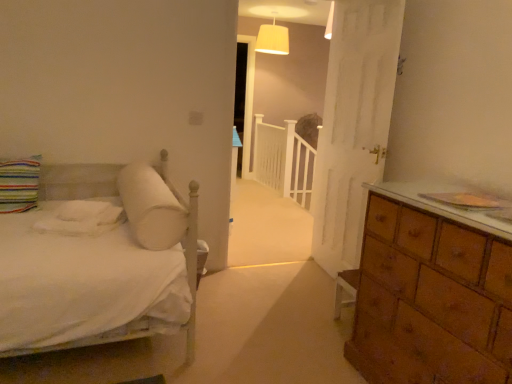
I want to click on white fabric lampshade at upper center, so click(x=273, y=39).

What do you see at coordinates (273, 39) in the screenshot? The image size is (512, 384). I see `white fabric lampshade at upper center` at bounding box center [273, 39].

Describe the element at coordinates (151, 207) in the screenshot. Image resolution: width=512 pixels, height=384 pixels. I see `white soft pillow at upper left, marked as the 1th pillow in a right-to-left arrangement` at that location.

This screenshot has height=384, width=512. I want to click on striped fabric pillow at left, marked as the 1th pillow in a left-to-right arrangement, so click(19, 184).

From the image's perspective, count 1st pillows upward from the white cotton sheet at left and point to it. Please provide its 2D coordinates.

[(151, 207)]

Is white soft pillow at upper left, positioned as the second pillow in left-to-right order, looking in the opposite direction of white cotton sheet at left?

No, white soft pillow at upper left, positioned as the second pillow in left-to-right order, is not facing away from white cotton sheet at left.

Is white soft pillow at upper left, marked as the 1th pillow in a right-to-left arrangement, smaller than white cotton sheet at left?

No.

From a real-world perspective, who is located higher, white soft pillow at upper left, positioned as the second pillow in left-to-right order, or white cotton sheet at left?

From a 3D spatial view, white soft pillow at upper left, positioned as the second pillow in left-to-right order, is above.

Looking at this image, from the image's perspective, is white soft pillow at upper left, positioned as the second pillow in left-to-right order, on striped fabric pillow at left, marked as the 1th pillow in a left-to-right arrangement?

Incorrect, from the image's perspective, white soft pillow at upper left, positioned as the second pillow in left-to-right order, is lower than striped fabric pillow at left, marked as the 1th pillow in a left-to-right arrangement.

Based on their sizes in the image, would you say white soft pillow at upper left, marked as the 1th pillow in a right-to-left arrangement, is bigger or smaller than striped fabric pillow at left, which ranks as the 2th pillow in right-to-left order?

Clearly, white soft pillow at upper left, marked as the 1th pillow in a right-to-left arrangement, is larger in size than striped fabric pillow at left, which ranks as the 2th pillow in right-to-left order.

Is white soft pillow at upper left, marked as the 1th pillow in a right-to-left arrangement, at the right side of striped fabric pillow at left, marked as the 1th pillow in a left-to-right arrangement?

Yes, white soft pillow at upper left, marked as the 1th pillow in a right-to-left arrangement, is to the right of striped fabric pillow at left, marked as the 1th pillow in a left-to-right arrangement.

Where is `pillow located underneath the striped fabric pillow at left, marked as the 1th pillow in a left-to-right arrangement (from a real-world perspective)`? The height and width of the screenshot is (384, 512). pillow located underneath the striped fabric pillow at left, marked as the 1th pillow in a left-to-right arrangement (from a real-world perspective) is located at coordinates (151, 207).

Which is in front, white fabric lampshade at upper center or white cotton sheet at left?

Positioned in front is white cotton sheet at left.

Does white fabric lampshade at upper center turn towards white cotton sheet at left?

No, white fabric lampshade at upper center is not aimed at white cotton sheet at left.

Considering the relative sizes of white fabric lampshade at upper center and white cotton sheet at left in the image provided, is white fabric lampshade at upper center shorter than white cotton sheet at left?

In fact, white fabric lampshade at upper center may be taller than white cotton sheet at left.

Considering the positions of points (265, 49) and (103, 214), is point (265, 49) farther from camera compared to point (103, 214)?

Yes, point (265, 49) is behind point (103, 214).

Between white soft pillow at upper left, marked as the 1th pillow in a right-to-left arrangement, and white fabric lampshade at upper center, which one appears on the left side from the viewer's perspective?

white soft pillow at upper left, marked as the 1th pillow in a right-to-left arrangement.

Considering the positions of objects white soft pillow at upper left, marked as the 1th pillow in a right-to-left arrangement, and white fabric lampshade at upper center in the image provided, who is in front, white soft pillow at upper left, marked as the 1th pillow in a right-to-left arrangement, or white fabric lampshade at upper center?

white soft pillow at upper left, marked as the 1th pillow in a right-to-left arrangement, is more forward.

Does white soft pillow at upper left, marked as the 1th pillow in a right-to-left arrangement, have a greater width compared to white fabric lampshade at upper center?

Yes, white soft pillow at upper left, marked as the 1th pillow in a right-to-left arrangement, is wider than white fabric lampshade at upper center.

How much distance is there between white cotton sheet at left and white fabric lampshade at upper center?

white cotton sheet at left and white fabric lampshade at upper center are 4.60 meters apart from each other.

From a real-world perspective, is white cotton sheet at left on white fabric lampshade at upper center?

Actually, white cotton sheet at left is physically below white fabric lampshade at upper center in the real world.

Is white cotton sheet at left further to camera compared to white fabric lampshade at upper center?

That is False.

Which is correct: white cotton sheet at left is inside white fabric lampshade at upper center, or outside of it?

white cotton sheet at left lies outside white fabric lampshade at upper center.

Is white fabric lampshade at upper center thinner than white soft pillow at upper left, positioned as the second pillow in left-to-right order?

Correct, the width of white fabric lampshade at upper center is less than that of white soft pillow at upper left, positioned as the second pillow in left-to-right order.

Image resolution: width=512 pixels, height=384 pixels. Find the location of `lamp behind the white soft pillow at upper left, positioned as the second pillow in left-to-right order`. lamp behind the white soft pillow at upper left, positioned as the second pillow in left-to-right order is located at coordinates (273, 39).

Which is more to the left, white fabric lampshade at upper center or white soft pillow at upper left, positioned as the second pillow in left-to-right order?

white soft pillow at upper left, positioned as the second pillow in left-to-right order, is more to the left.

From the picture: Is white fabric lampshade at upper center aimed at white soft pillow at upper left, marked as the 1th pillow in a right-to-left arrangement?

No, white fabric lampshade at upper center does not turn towards white soft pillow at upper left, marked as the 1th pillow in a right-to-left arrangement.

Is white cotton sheet at left positioned behind white soft pillow at upper left, marked as the 1th pillow in a right-to-left arrangement?

Yes, it is.

Is white cotton sheet at left facing towards white soft pillow at upper left, marked as the 1th pillow in a right-to-left arrangement?

No, white cotton sheet at left is not turned towards white soft pillow at upper left, marked as the 1th pillow in a right-to-left arrangement.

Based on their positions, is white cotton sheet at left located to the left or right of white soft pillow at upper left, positioned as the second pillow in left-to-right order?

In the image, white cotton sheet at left appears on the left side of white soft pillow at upper left, positioned as the second pillow in left-to-right order.

Is point (42, 225) positioned behind point (176, 228)?

Yes, point (42, 225) is behind point (176, 228).

In the image, there is a white soft pillow at upper left, positioned as the second pillow in left-to-right order. Identify the location of sheet below it (from the image's perspective). This screenshot has width=512, height=384. (81, 218).

You are a GUI agent. You are given a task and a screenshot of the screen. Output one action in this format:
    pyautogui.click(x=<x>, y=<y>)
    Task: Click on the pillow behind the white soft pillow at upper left, positioned as the second pillow in left-to-right order
    The width and height of the screenshot is (512, 384).
    Given the screenshot: What is the action you would take?
    pyautogui.click(x=19, y=184)

Which object lies nearer to the anchor point white soft pillow at upper left, positioned as the second pillow in left-to-right order, white fabric lampshade at upper center or striped fabric pillow at left, marked as the 1th pillow in a left-to-right arrangement?

The object closer to white soft pillow at upper left, positioned as the second pillow in left-to-right order, is striped fabric pillow at left, marked as the 1th pillow in a left-to-right arrangement.

Based on their spatial positions, is white cotton sheet at left or white soft pillow at upper left, positioned as the second pillow in left-to-right order, closer to striped fabric pillow at left, marked as the 1th pillow in a left-to-right arrangement?

white cotton sheet at left.

Estimate the real-world distances between objects in this image. Which object is closer to white fabric lampshade at upper center, white cotton sheet at left or striped fabric pillow at left, marked as the 1th pillow in a left-to-right arrangement?

striped fabric pillow at left, marked as the 1th pillow in a left-to-right arrangement, is closer to white fabric lampshade at upper center.

From the image, which object appears to be farther from white cotton sheet at left, white soft pillow at upper left, positioned as the second pillow in left-to-right order, or white fabric lampshade at upper center?

Based on the image, white fabric lampshade at upper center appears to be further to white cotton sheet at left.

When comparing their distances from striped fabric pillow at left, marked as the 1th pillow in a left-to-right arrangement, does white soft pillow at upper left, marked as the 1th pillow in a right-to-left arrangement, or white fabric lampshade at upper center seem further?

Among the two, white fabric lampshade at upper center is located further to striped fabric pillow at left, marked as the 1th pillow in a left-to-right arrangement.

Based on their spatial positions, is striped fabric pillow at left, which ranks as the 2th pillow in right-to-left order, or white fabric lampshade at upper center closer to white cotton sheet at left?

striped fabric pillow at left, which ranks as the 2th pillow in right-to-left order.

Looking at the image, which one is located further to white fabric lampshade at upper center, white soft pillow at upper left, positioned as the second pillow in left-to-right order, or striped fabric pillow at left, which ranks as the 2th pillow in right-to-left order?

striped fabric pillow at left, which ranks as the 2th pillow in right-to-left order.

When comparing their distances from white soft pillow at upper left, positioned as the second pillow in left-to-right order, does white cotton sheet at left or striped fabric pillow at left, marked as the 1th pillow in a left-to-right arrangement, seem further?

striped fabric pillow at left, marked as the 1th pillow in a left-to-right arrangement, is further to white soft pillow at upper left, positioned as the second pillow in left-to-right order.

The height and width of the screenshot is (384, 512). I want to click on sheet located between striped fabric pillow at left, which ranks as the 2th pillow in right-to-left order, and white soft pillow at upper left, marked as the 1th pillow in a right-to-left arrangement, in the left-right direction, so click(x=81, y=218).

Find the location of a particular element. Image resolution: width=512 pixels, height=384 pixels. sheet between white soft pillow at upper left, marked as the 1th pillow in a right-to-left arrangement, and white fabric lampshade at upper center from front to back is located at coordinates (81, 218).

The width and height of the screenshot is (512, 384). In order to click on pillow between white soft pillow at upper left, positioned as the second pillow in left-to-right order, and white fabric lampshade at upper center in the front-back direction in this screenshot , I will do `click(19, 184)`.

The height and width of the screenshot is (384, 512). What are the coordinates of `pillow between white cotton sheet at left and white fabric lampshade at upper center along the z-axis` in the screenshot? It's located at (19, 184).